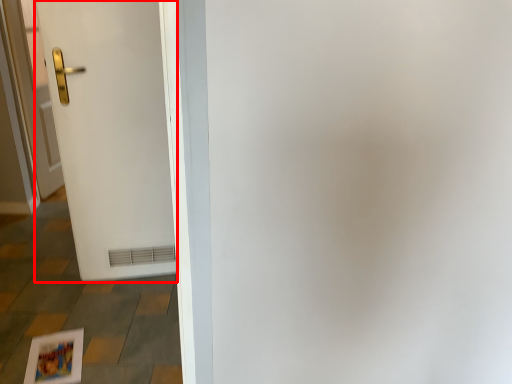
Question: Where is door (annotated by the red box) located in relation to door in the image?

Choices:
 (A) right
 (B) left

Answer: (A)